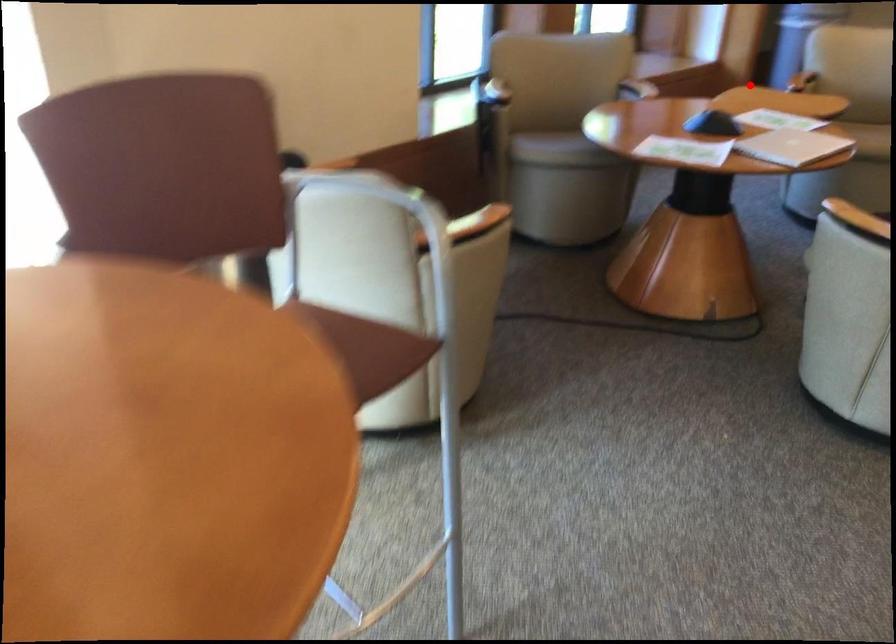
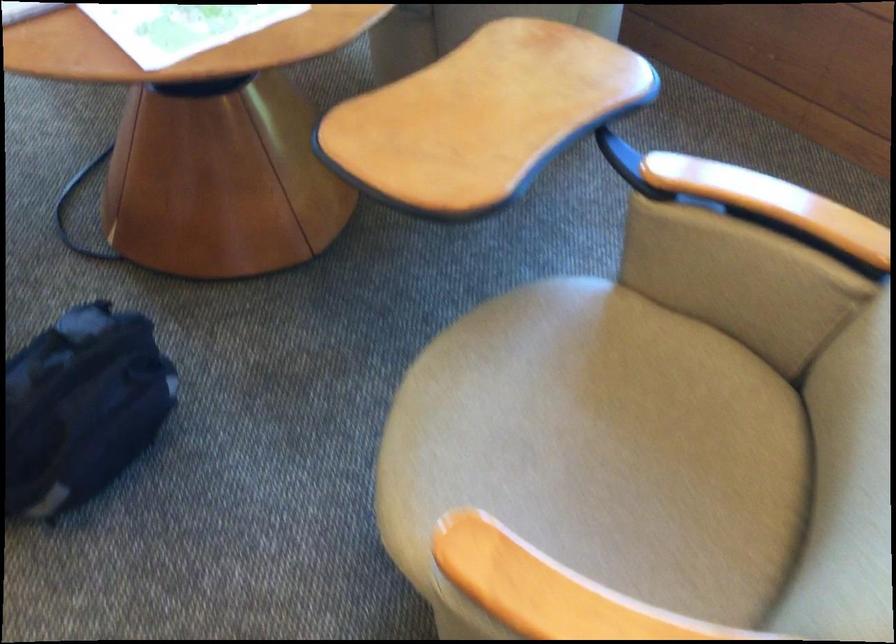
Question: I am providing you with two images of the same scene from different viewpoints. Given a red point in image1, look at the same physical point in image2. Is it:

Choices:
 (A) Closer to the viewpoint
 (B) Farther from the viewpoint

Answer: (A)